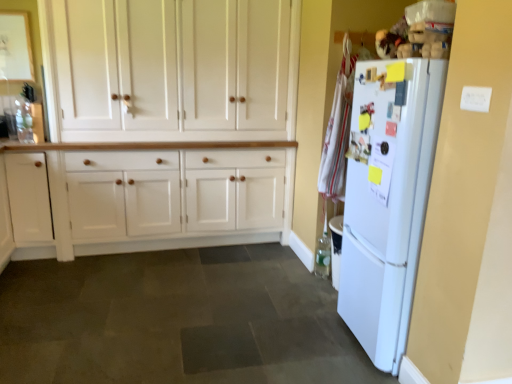
Question: Considering the positions of white wood cabinet at center, which ranks as the first cabinetry in right-to-left order, and dark gray tile floor at center in the image, is white wood cabinet at center, which ranks as the first cabinetry in right-to-left order, taller or shorter than dark gray tile floor at center?

Choices:
 (A) tall
 (B) short

Answer: (A)

Question: In terms of width, does white wood cabinet at center, which appears as the 2th cabinetry when viewed from the left, look wider or thinner when compared to dark gray tile floor at center?

Choices:
 (A) thin
 (B) wide

Answer: (A)

Question: Which object is positioned closest to the white wood cabinet at left, the 2th cabinetry when ordered from right to left?

Choices:
 (A) dark gray tile floor at center
 (B) white wood cabinet at center, which appears as the 2th cabinetry when viewed from the left
 (C) white matte refrigerator at right

Answer: (B)

Question: Estimate the real-world distances between objects in this image. Which object is closer to the white wood cabinet at left, which ranks as the first cabinetry in left-to-right order?

Choices:
 (A) white matte refrigerator at right
 (B) dark gray tile floor at center
 (C) white wood cabinet at center, which ranks as the first cabinetry in right-to-left order

Answer: (C)